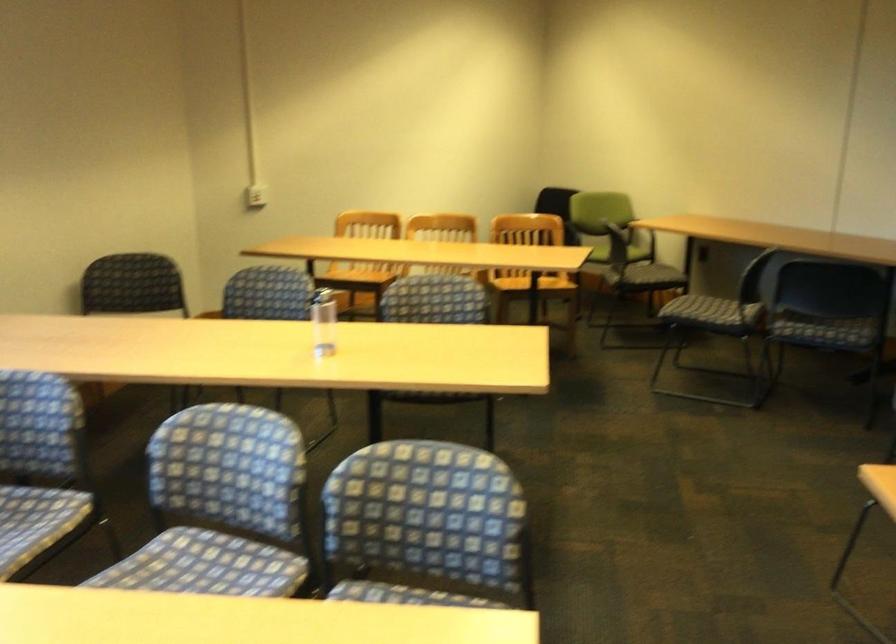
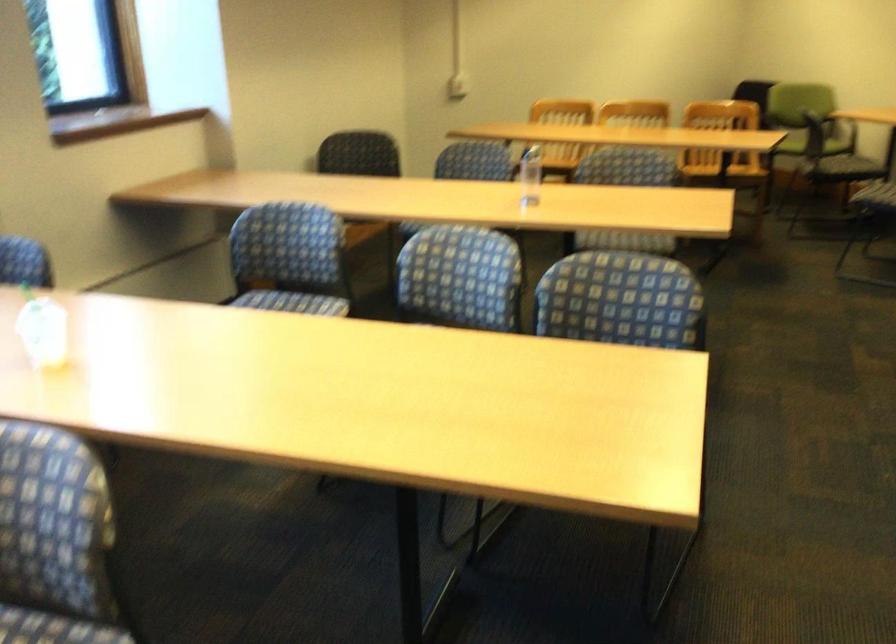
Question: Based on the continuous images, in which direction is the camera rotating? Reply with the corresponding letter.

Choices:
 (A) Left
 (B) Right
 (C) Up
 (D) Down

Answer: (A)